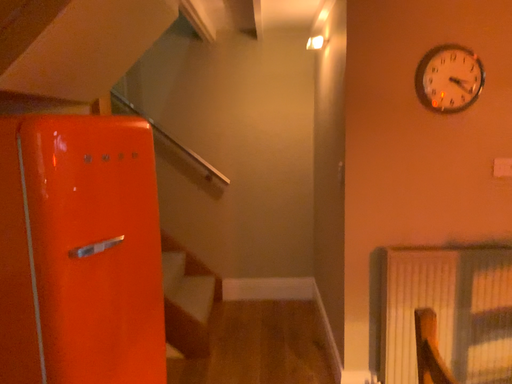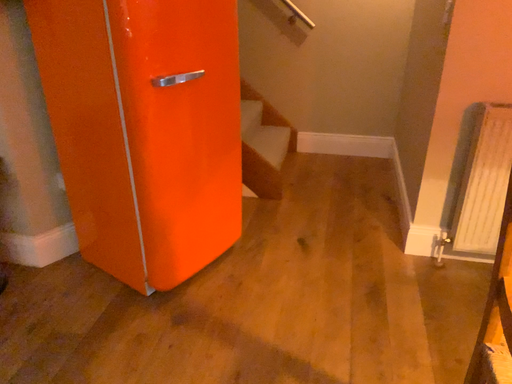
Question: How did the camera likely rotate when shooting the video?

Choices:
 (A) rotated right
 (B) rotated left

Answer: (B)